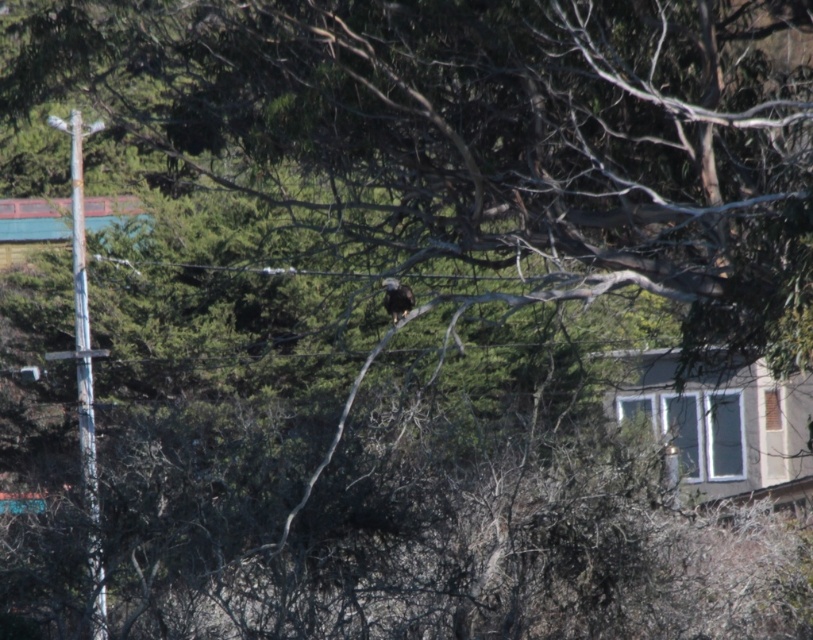
Question: Which point appears closest to the camera in this image?

Choices:
 (A) (390, 308)
 (B) (89, 360)

Answer: (A)

Question: Which of the following is the farthest from the observer?

Choices:
 (A) rusty metal pole at left
 (B) dark brown feathers at center

Answer: (A)

Question: Does rusty metal pole at left have a larger size compared to dark brown feathers at center?

Choices:
 (A) yes
 (B) no

Answer: (A)

Question: Is rusty metal pole at left thinner than dark brown feathers at center?

Choices:
 (A) yes
 (B) no

Answer: (B)

Question: Is rusty metal pole at left below dark brown feathers at center?

Choices:
 (A) yes
 (B) no

Answer: (A)